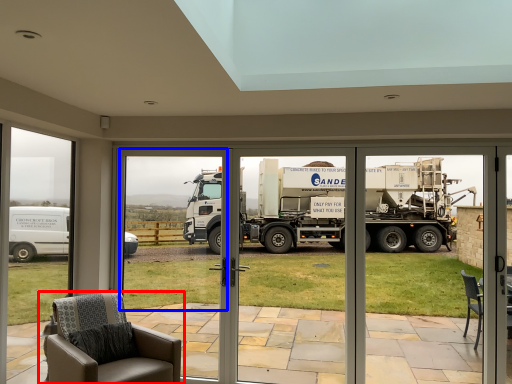
Question: Which of the following is the farthest to the observer, chair (highlighted by a red box) or window screen (highlighted by a blue box)?

Choices:
 (A) chair
 (B) window screen

Answer: (B)